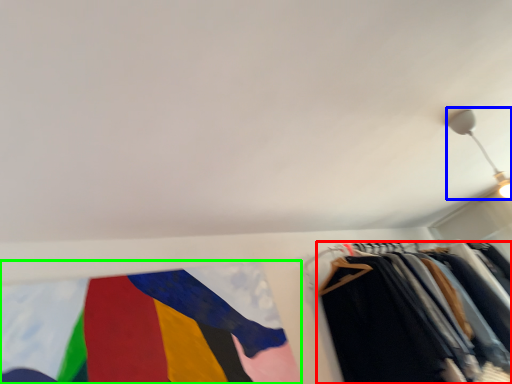
Question: Which is farther away from trousers (highlighted by a red box)? light fixture (highlighted by a blue box) or flag (highlighted by a green box)?

Choices:
 (A) light fixture
 (B) flag

Answer: (A)